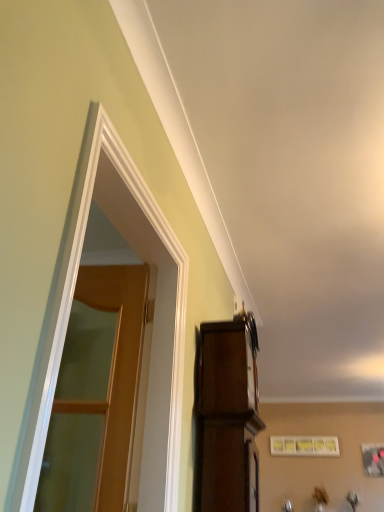
Question: From the image's perspective, is matte white picture frame at upper center located above or below wooden at left?

Choices:
 (A) below
 (B) above

Answer: (A)

Question: In terms of height, does matte white picture frame at upper center look taller or shorter compared to wooden at left?

Choices:
 (A) short
 (B) tall

Answer: (A)

Question: Estimate the real-world distances between objects in this image. Which object is farther from the dark wood cabinet at upper right?

Choices:
 (A) white glossy door at left
 (B) wooden at left
 (C) matte white picture frame at upper center

Answer: (C)

Question: Which of these objects is positioned closest to the dark wood cabinet at upper right?

Choices:
 (A) wooden at left
 (B) white glossy door at left
 (C) matte white picture frame at upper center

Answer: (B)